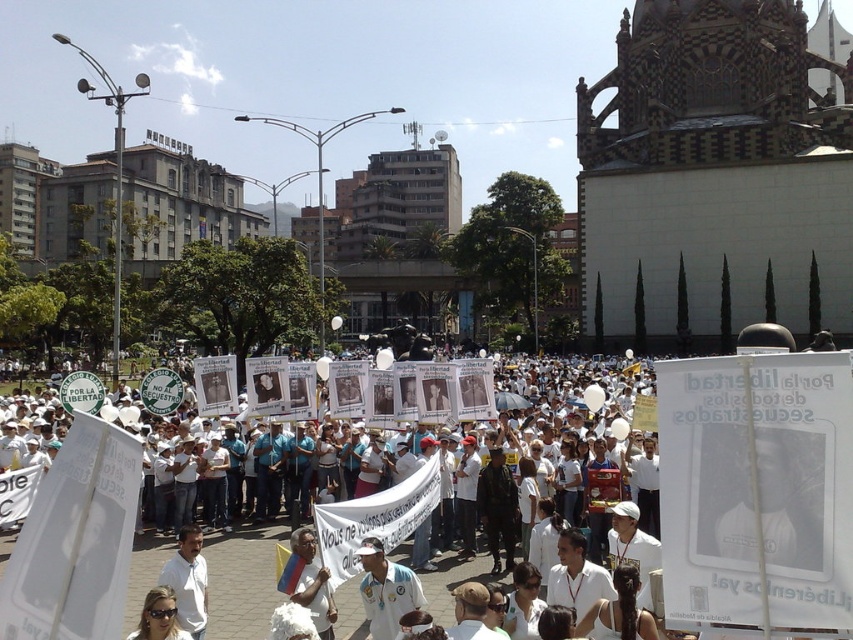
Which is more to the left, white paper sign at center or white fabric shirt at center?

From the viewer's perspective, white paper sign at center appears more on the left side.

The width and height of the screenshot is (853, 640). What are the coordinates of `white paper sign at center` in the screenshot? It's located at (119, 540).

Is white fabric shirt at center wider than white shirt at center?

Indeed, white fabric shirt at center has a greater width compared to white shirt at center.

Image resolution: width=853 pixels, height=640 pixels. I want to click on white fabric shirt at center, so click(x=386, y=589).

Can you confirm if white paper sign at center is positioned below white shirt at center?

Incorrect, white paper sign at center is not positioned below white shirt at center.

Which of these two, white paper sign at center or white shirt at center, stands shorter?

white shirt at center is shorter.

Which is in front, point (248, 621) or point (323, 568)?

Point (323, 568) is in front.

At what (x,y) coordinates should I click in order to perform the action: click on white paper sign at center. Please return your answer as a coordinate pair (x, y). The width and height of the screenshot is (853, 640). Looking at the image, I should click on (119, 540).